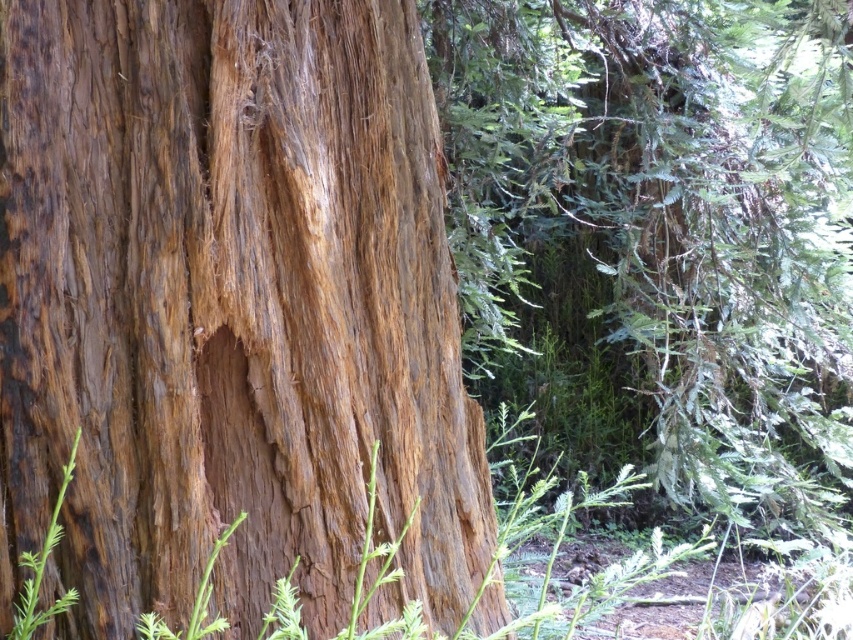
Which is behind, point (309, 412) or point (350, 636)?

The point (309, 412) is more distant.

Does brown rough bark at center have a smaller size compared to green fuzzy plant at center?

No, brown rough bark at center is not smaller than green fuzzy plant at center.

Which is behind, point (9, 502) or point (368, 518)?

Positioned behind is point (9, 502).

You are a GUI agent. You are given a task and a screenshot of the screen. Output one action in this format:
    pyautogui.click(x=<x>, y=<y>)
    Task: Click on the brown rough bark at center
    This screenshot has height=640, width=853.
    Given the screenshot: What is the action you would take?
    pyautogui.click(x=229, y=308)

Does brown rough bark at center appear on the left side of green fibrous weed at lower left?

Incorrect, brown rough bark at center is not on the left side of green fibrous weed at lower left.

Is point (384, 397) positioned after point (215, 552)?

Yes, point (384, 397) is farther from viewer.

Is point (80, 515) positioned after point (206, 570)?

Yes, point (80, 515) is behind point (206, 570).

I want to click on brown rough bark at center, so pyautogui.click(x=229, y=308).

Is green rough stem at lower left bigger than green fibrous weed at lower left?

Incorrect, green rough stem at lower left is not larger than green fibrous weed at lower left.

Can you confirm if green rough stem at lower left is positioned above green fibrous weed at lower left?

Indeed, green rough stem at lower left is positioned over green fibrous weed at lower left.

Is point (33, 573) closer to viewer compared to point (195, 596)?

That is True.

Locate an element on the screen. green rough stem at lower left is located at coordinates (44, 566).